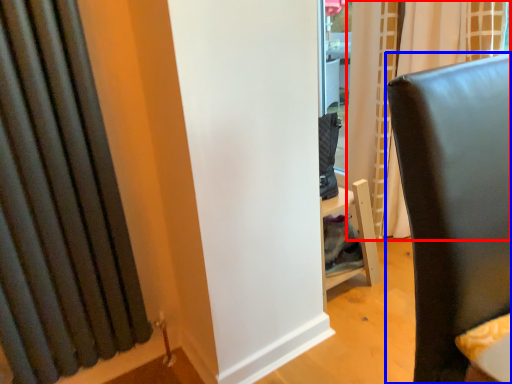
Question: Among these objects, which one is farthest to the camera, curtain (highlighted by a red box) or furniture (highlighted by a blue box)?

Choices:
 (A) curtain
 (B) furniture

Answer: (A)